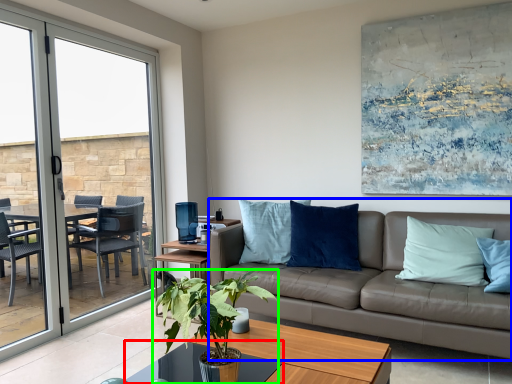
Question: Which object is positioned closest to glass table (highlighted by a red box)? Select from studio couch (highlighted by a blue box) and houseplant (highlighted by a green box).

Choices:
 (A) studio couch
 (B) houseplant

Answer: (B)